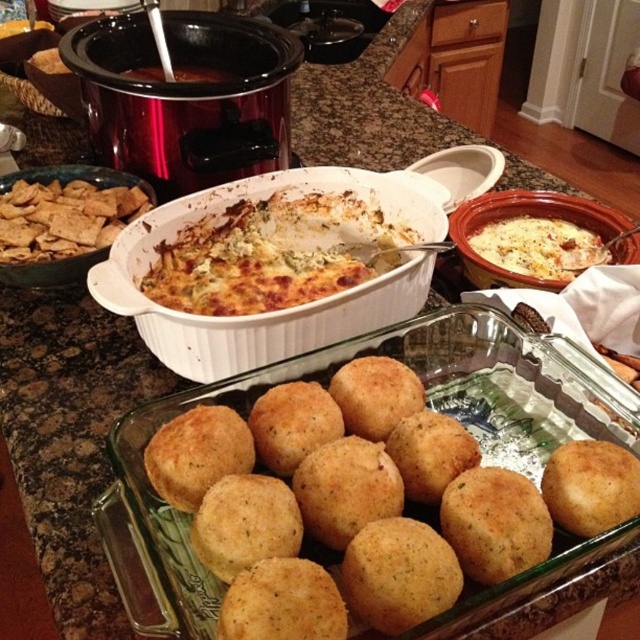
You are arranging a buffet table and need to place the golden baked casserole at center and the brown cracker at left. According to the image, which one is positioned lower on the table?

The golden baked casserole at center is positioned lower than the brown cracker at left, so it is placed below it.

You are arranging food on a kitchen counter for a party. You have the golden brown crumbly balls at center and the brown cracker at left. According to the image, which of these two items is positioned lower on the counter?

The golden brown crumbly balls at center is located below the brown cracker at left, so it is positioned lower on the counter.

You are standing in front of the kitchen countertop and want to place a new dish between the two points marked as point (385, 259) and point (92, 236). Which point should you use as a reference to ensure the new dish is placed in the middle?

Since point (385, 259) is in front of point (92, 236), the middle position between them would be closer to point (92, 236). Therefore, use point (92, 236) as the reference to place the new dish in the middle.